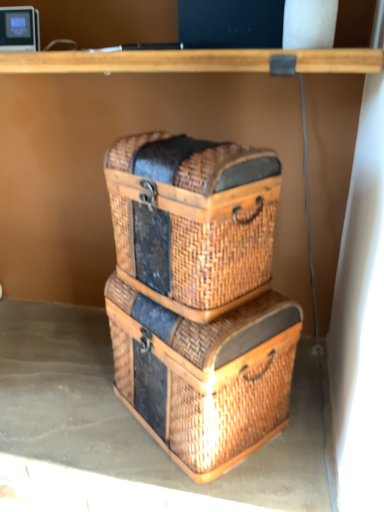
At what (x,y) coordinates should I click in order to perform the action: click on vacant area that lies to the right of woven brown crate at center. Please return your answer as a coordinate pair (x, y). The width and height of the screenshot is (384, 512). Looking at the image, I should click on (307, 413).